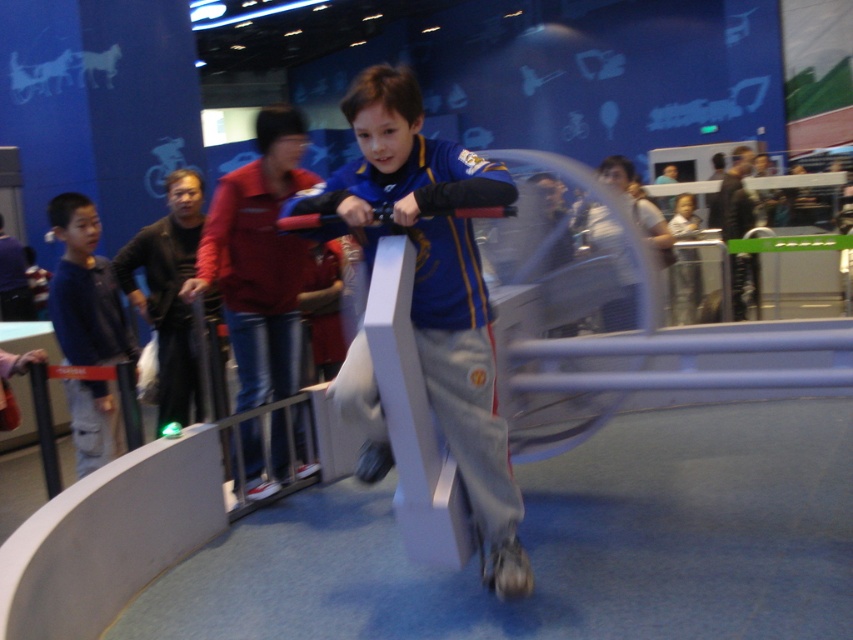
Is blue fabric jacket at center taller than blue denim jacket at left?

Yes, blue fabric jacket at center is taller than blue denim jacket at left.

Find the location of a particular element. This screenshot has width=853, height=640. blue fabric jacket at center is located at coordinates (434, 285).